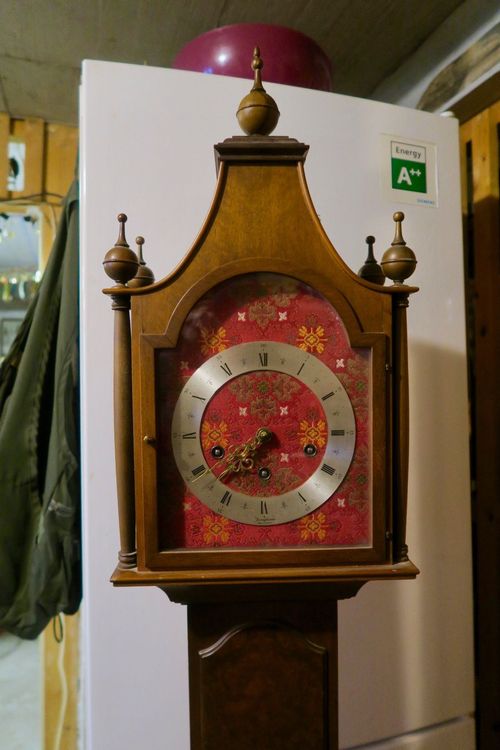
You are a GUI agent. You are given a task and a screenshot of the screen. Output one action in this format:
    pyautogui.click(x=<x>, y=<y>)
    Task: Click on the fridge
    This screenshot has width=500, height=750.
    Given the screenshot: What is the action you would take?
    [146, 118], [347, 130], [433, 630], [139, 646]